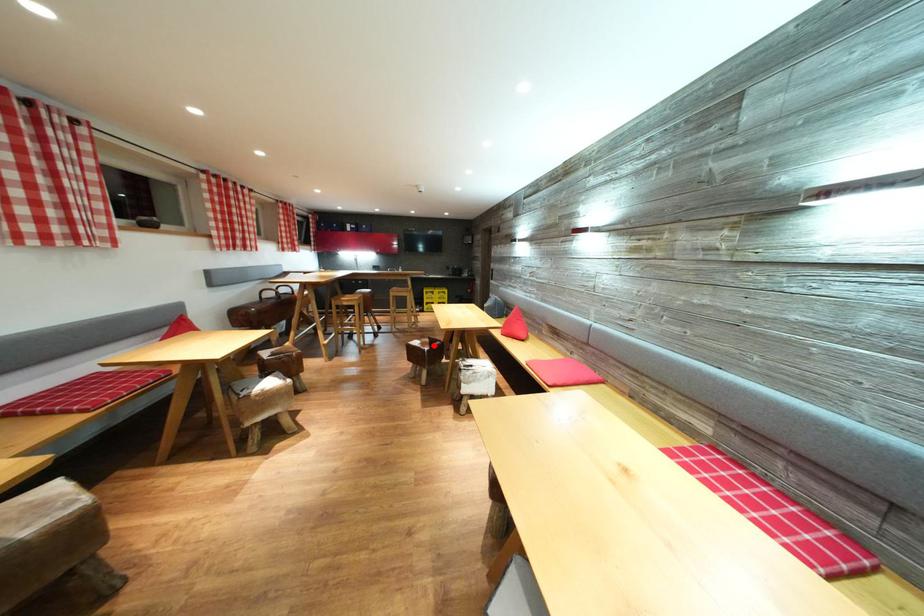
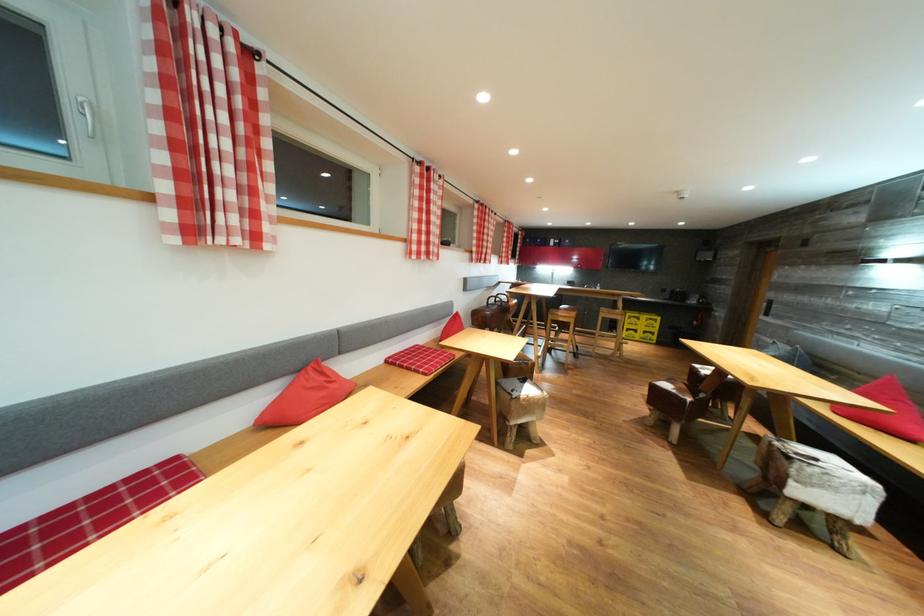
In the second image, find the point that corresponds to the highlighted location in the first image.

(689, 392)